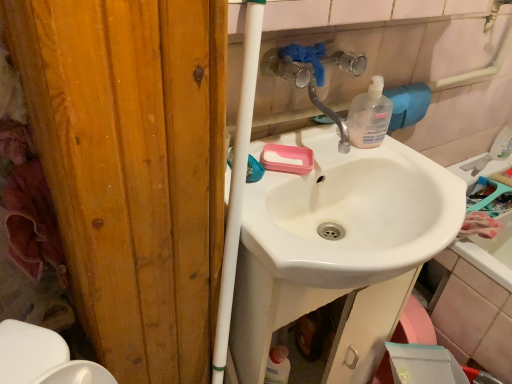
Question: Does translucent plastic soap dispenser at upper right have a lesser width compared to clear plastic faucet at upper center?

Choices:
 (A) no
 (B) yes

Answer: (B)

Question: Is translucent plastic soap dispenser at upper right turned away from clear plastic faucet at upper center?

Choices:
 (A) yes
 (B) no

Answer: (B)

Question: Does translucent plastic soap dispenser at upper right contain clear plastic faucet at upper center?

Choices:
 (A) yes
 (B) no

Answer: (B)

Question: Can you confirm if translucent plastic soap dispenser at upper right is smaller than clear plastic faucet at upper center?

Choices:
 (A) yes
 (B) no

Answer: (A)

Question: Is translucent plastic soap dispenser at upper right positioned far away from clear plastic faucet at upper center?

Choices:
 (A) no
 (B) yes

Answer: (A)

Question: Is clear plastic faucet at upper center to the left or to the right of white glossy sink at center in the image?

Choices:
 (A) right
 (B) left

Answer: (B)

Question: From the image's perspective, relative to white glossy sink at center, is clear plastic faucet at upper center above or below?

Choices:
 (A) below
 (B) above

Answer: (B)

Question: Is clear plastic faucet at upper center in front of or behind white glossy sink at center in the image?

Choices:
 (A) behind
 (B) front

Answer: (B)

Question: Is clear plastic faucet at upper center wider or thinner than white glossy sink at center?

Choices:
 (A) thin
 (B) wide

Answer: (A)

Question: Is point (321, 59) positioned closer to the camera than point (359, 104)?

Choices:
 (A) farther
 (B) closer

Answer: (B)

Question: Is clear plastic faucet at upper center bigger or smaller than translucent plastic soap dispenser at upper right?

Choices:
 (A) small
 (B) big

Answer: (B)

Question: Would you say clear plastic faucet at upper center is to the left or to the right of translucent plastic soap dispenser at upper right in the picture?

Choices:
 (A) right
 (B) left

Answer: (B)

Question: From a real-world perspective, is clear plastic faucet at upper center positioned above or below translucent plastic soap dispenser at upper right?

Choices:
 (A) above
 (B) below

Answer: (A)

Question: From a real-world perspective, is translucent plastic soap dispenser at upper right above or below pink matte soap at center?

Choices:
 (A) below
 (B) above

Answer: (B)

Question: Visually, is translucent plastic soap dispenser at upper right positioned to the left or to the right of pink matte soap at center?

Choices:
 (A) right
 (B) left

Answer: (A)